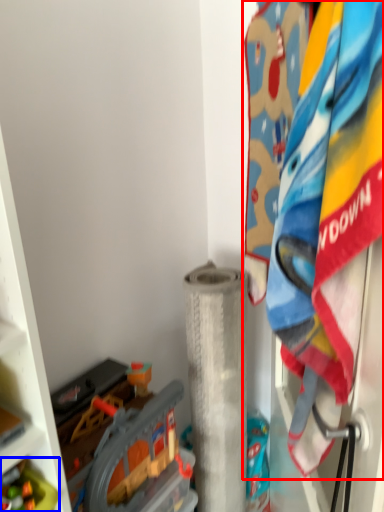
Question: Which object is further to the camera taking this photo, laundry (highlighted by a red box) or toy (highlighted by a blue box)?

Choices:
 (A) laundry
 (B) toy

Answer: (B)